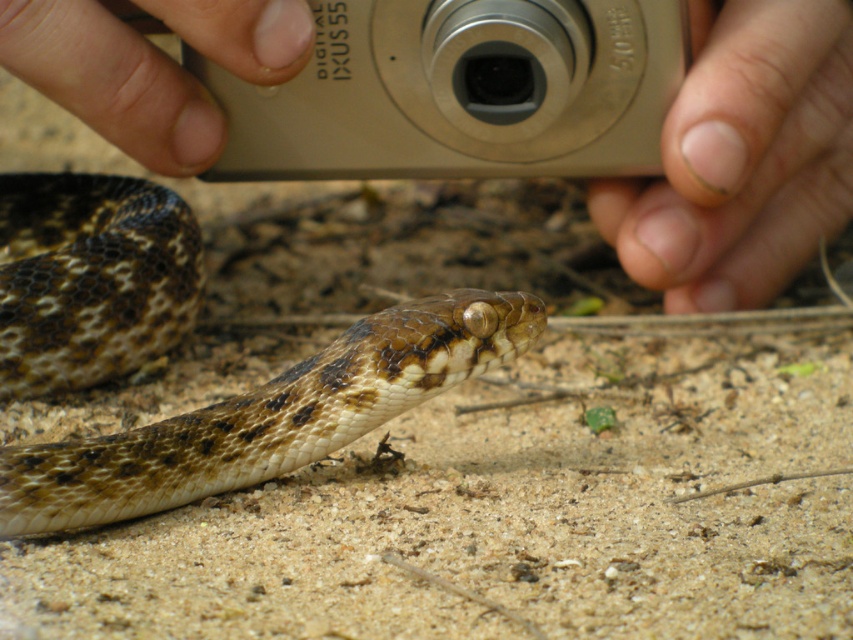
You are a photographer trying to capture a close up of the brown scaly snake at center and the silver metallic camera at upper center. Which object is wider?

The silver metallic camera at upper center is wider than the brown scaly snake at center.

You are a photographer trying to capture the snake in the image. You have a Canon IXUS 55 camera and notice the silver metallic camera at upper center and the nail polish on fingernail at upper right in your viewfinder. Which object takes up more area in your current frame?

The nail polish on fingernail at upper right takes up more area in the frame than the silver metallic camera at upper center because the silver metallic camera at upper center occupies less space than nail polish on fingernail at upper right.